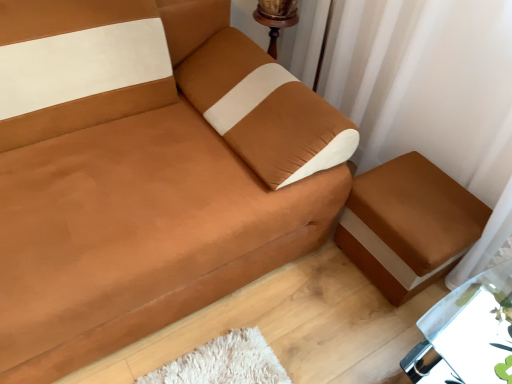
Question: Does brown fabric ottoman at lower right appear on the right side of metallic silver table at lower right?

Choices:
 (A) no
 (B) yes

Answer: (A)

Question: Considering the relative sizes of brown fabric ottoman at lower right and metallic silver table at lower right in the image provided, is brown fabric ottoman at lower right thinner than metallic silver table at lower right?

Choices:
 (A) yes
 (B) no

Answer: (A)

Question: Is metallic silver table at lower right completely or partially inside brown fabric ottoman at lower right?

Choices:
 (A) yes
 (B) no

Answer: (B)

Question: Is brown fabric ottoman at lower right looking in the opposite direction of metallic silver table at lower right?

Choices:
 (A) yes
 (B) no

Answer: (B)

Question: Considering the relative sizes of brown fabric ottoman at lower right and metallic silver table at lower right in the image provided, is brown fabric ottoman at lower right shorter than metallic silver table at lower right?

Choices:
 (A) no
 (B) yes

Answer: (B)

Question: From the image's perspective, is brown fabric ottoman at lower right above metallic silver table at lower right?

Choices:
 (A) yes
 (B) no

Answer: (A)

Question: Considering the relative sizes of suede-like brown couch at center and white sheer curtain at upper right in the image provided, is suede-like brown couch at center smaller than white sheer curtain at upper right?

Choices:
 (A) yes
 (B) no

Answer: (B)

Question: From the image's perspective, would you say suede-like brown couch at center is shown under white sheer curtain at upper right?

Choices:
 (A) no
 (B) yes

Answer: (B)

Question: Is suede-like brown couch at center positioned behind white sheer curtain at upper right?

Choices:
 (A) yes
 (B) no

Answer: (B)

Question: Are suede-like brown couch at center and white sheer curtain at upper right beside each other?

Choices:
 (A) yes
 (B) no

Answer: (B)

Question: Is suede-like brown couch at center aimed at white sheer curtain at upper right?

Choices:
 (A) yes
 (B) no

Answer: (B)

Question: Can you confirm if suede-like brown couch at center is shorter than white sheer curtain at upper right?

Choices:
 (A) no
 (B) yes

Answer: (B)

Question: From a real-world perspective, is suede-like brown couch at center physically above metallic silver table at lower right?

Choices:
 (A) no
 (B) yes

Answer: (B)